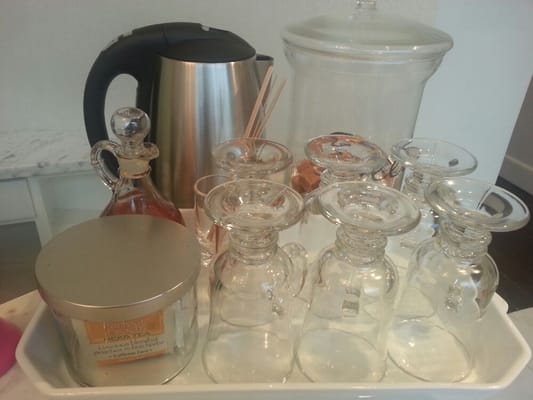
Where is `carafe`? This screenshot has width=533, height=400. carafe is located at coordinates (218, 102).